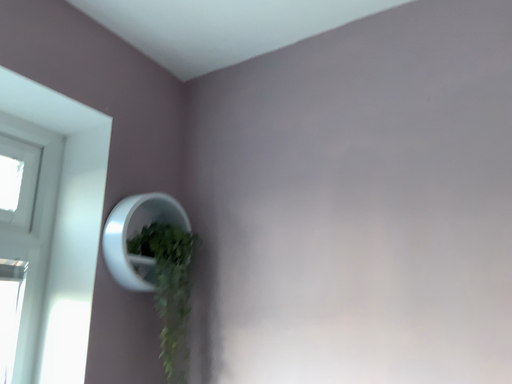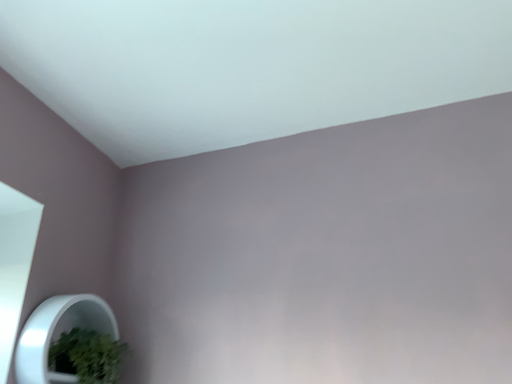
Question: Which way did the camera rotate in the video?

Choices:
 (A) rotated right
 (B) rotated left

Answer: (A)